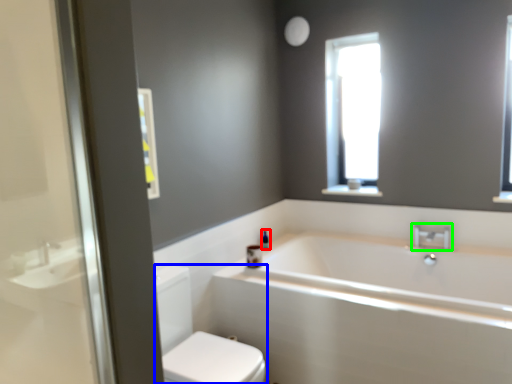
Question: Which object is positioned farthest from toiletry (highlighted by a red box)? Select from toilet bowl (highlighted by a blue box) and tap (highlighted by a green box).

Choices:
 (A) toilet bowl
 (B) tap

Answer: (B)